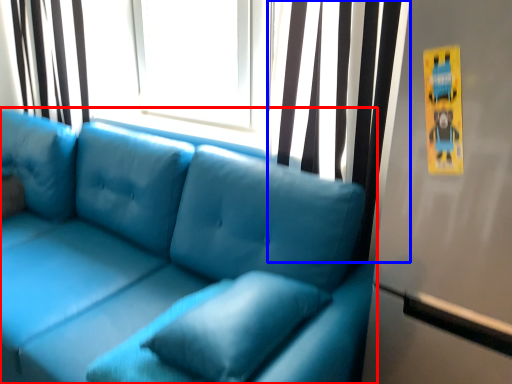
Question: Which object is closer to the camera taking this photo, studio couch (highlighted by a red box) or curtain (highlighted by a blue box)?

Choices:
 (A) studio couch
 (B) curtain

Answer: (A)